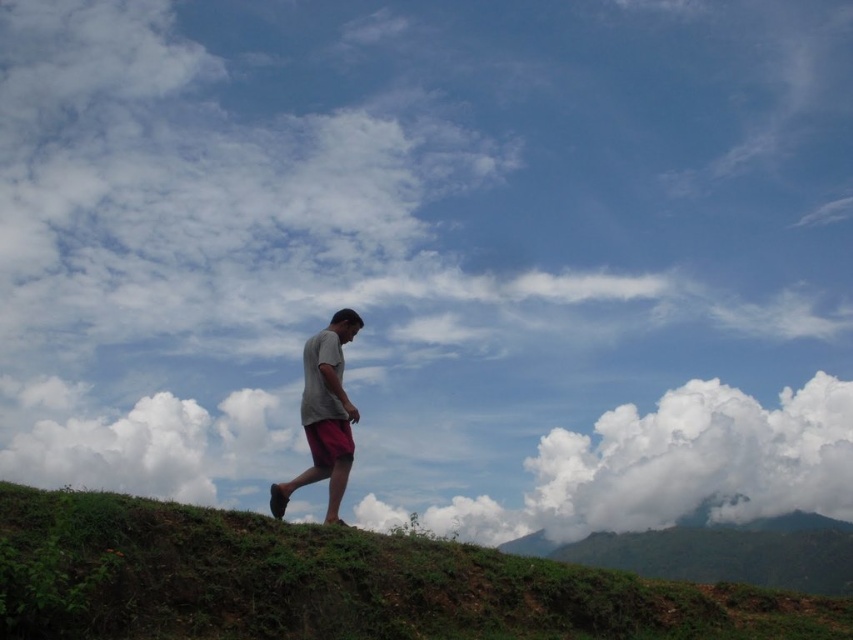
You are standing at the base of the hill and want to take a photo of the white fluffy cloud at upper left and the green leafy hillside at lower right in the same frame. Which object should you position closer to the left side of your camera viewfinder to include both?

To include both the white fluffy cloud at upper left and the green leafy hillside at lower right in the same frame, position the white fluffy cloud at upper left closer to the left side of your camera viewfinder since it is already on the left side of the green leafy hillside at lower right.

You are standing at the point labeled as point (718,550) in the image. Looking around, what type of terrain or feature is directly beneath your feet?

The point (718,550) is located on a green leafy hillside at lower right, so the terrain beneath your feet is part of the green leafy hillside.

You are standing on the green grassy hillside at center and want to look at the white fluffy cloud at right. In which direction should you turn your head to see it?

The white fluffy cloud at right is on the right side of the green grassy hillside at center, so you should turn your head to the right to see it.